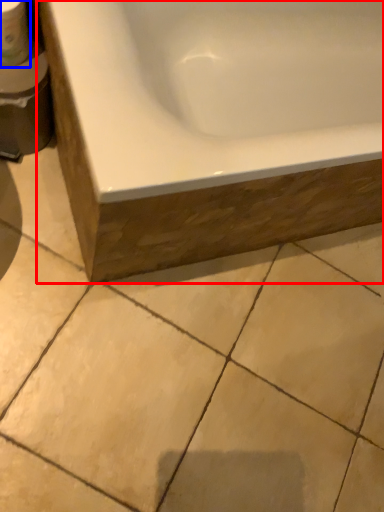
Question: Among these objects, which one is farthest to the camera, bathtub (highlighted by a red box) or toilet paper (highlighted by a blue box)?

Choices:
 (A) bathtub
 (B) toilet paper

Answer: (B)